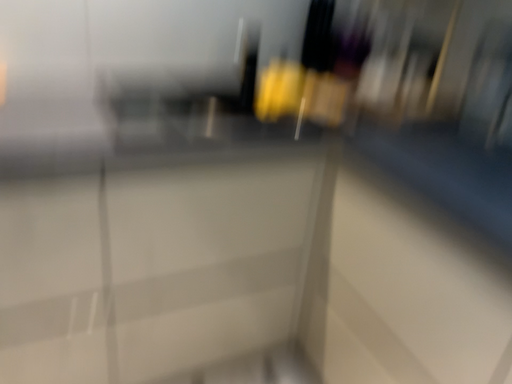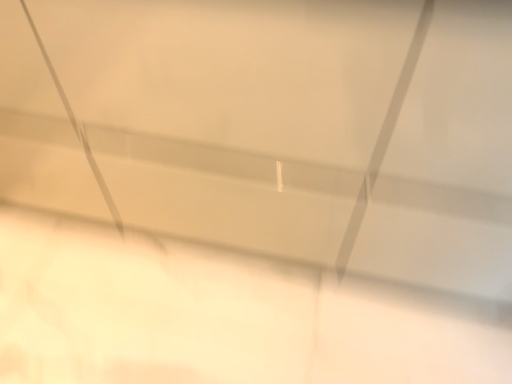
Question: How did the camera likely rotate when shooting the video?

Choices:
 (A) rotated left
 (B) rotated right

Answer: (B)